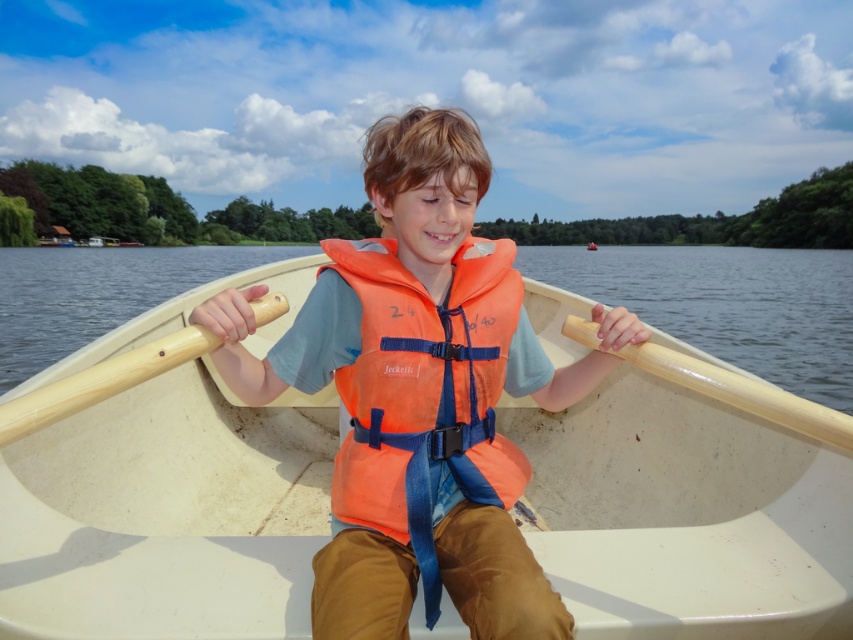
Question: Can you confirm if transparent water at center is positioned to the left of wooden paddle at left?

Choices:
 (A) no
 (B) yes

Answer: (B)

Question: Is orange life vest at center positioned before wooden paddle at left?

Choices:
 (A) no
 (B) yes

Answer: (A)

Question: Which point is closer to the camera?

Choices:
 (A) wooden paddle at center
 (B) transparent water at center
 (C) wooden paddle at left

Answer: (C)

Question: Does wooden paddle at left have a lesser width compared to wooden paddle at center?

Choices:
 (A) no
 (B) yes

Answer: (B)

Question: Which point is closer to the camera?

Choices:
 (A) transparent water at center
 (B) orange life vest at center
 (C) white plastic boat at center

Answer: (B)

Question: Based on their relative distances, which object is farther from the wooden paddle at left?

Choices:
 (A) wooden paddle at center
 (B) transparent water at center
 (C) orange life vest at center
 (D) white plastic boat at center

Answer: (B)